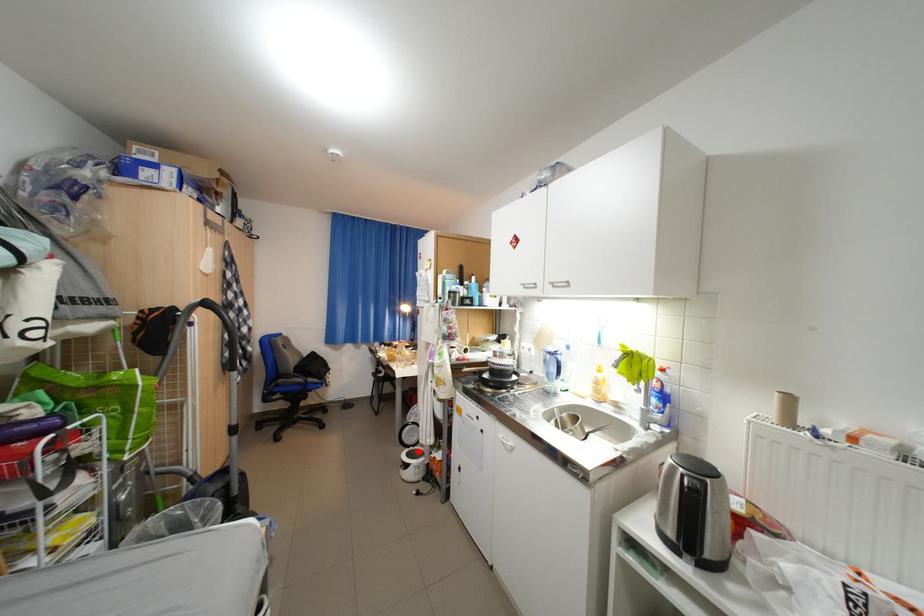
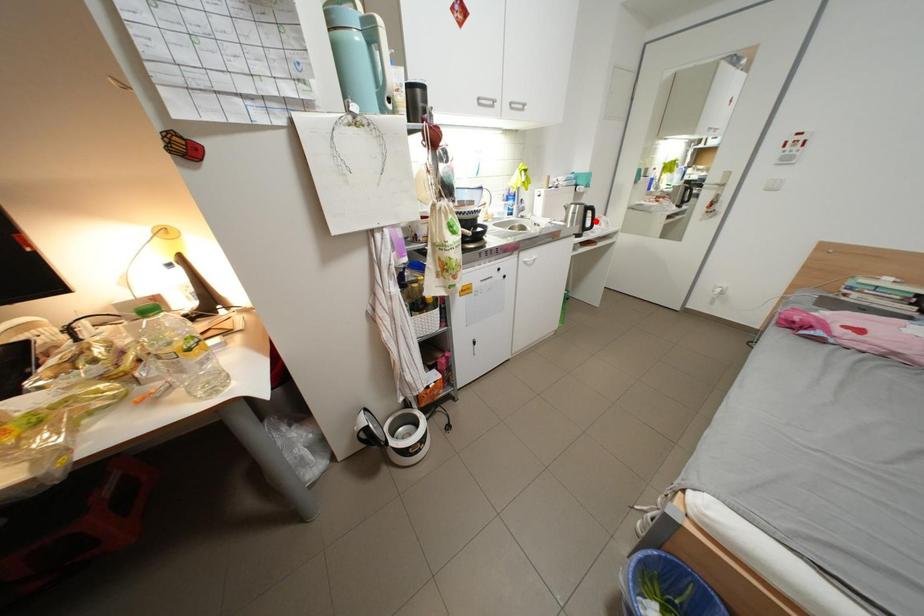
I am providing you with two images of the same scene from different viewpoints. A red point is marked on the first image and another point is marked on the second image. Does the point marked in image1 correspond to the same location as the one in image2?

No